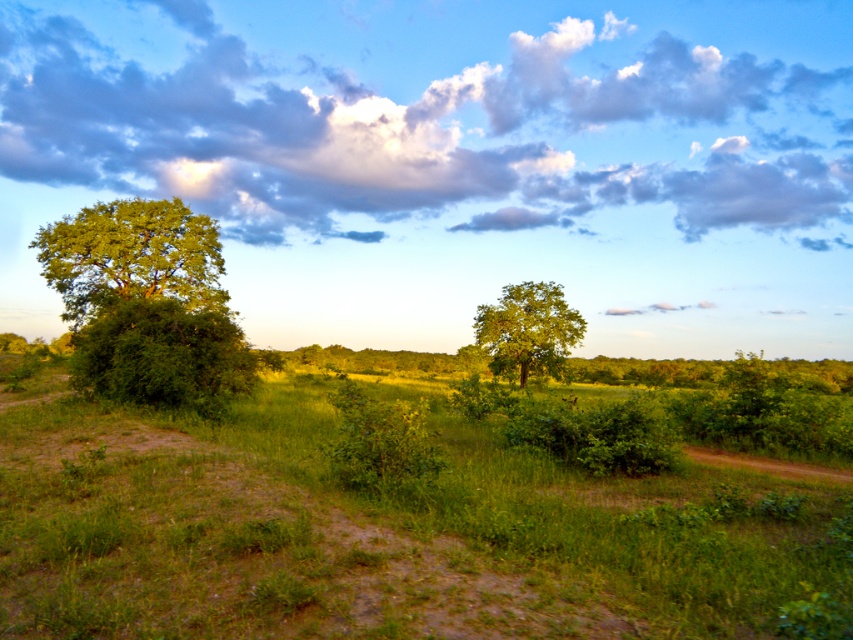
You are planning to take a photo of the cloudy sky at upper center and the green leafy tree at center. Which object will occupy a larger portion of the photo?

The cloudy sky at upper center will occupy a larger portion of the photo because it is bigger than the green leafy tree at center according to the description.

You are standing at the edge of the dirt path in the rural landscape. You see a green leafy tree at left and a green leafy tree at center. Which tree is positioned higher in the image?

The green leafy tree at left is positioned higher in the image than the green leafy tree at center.